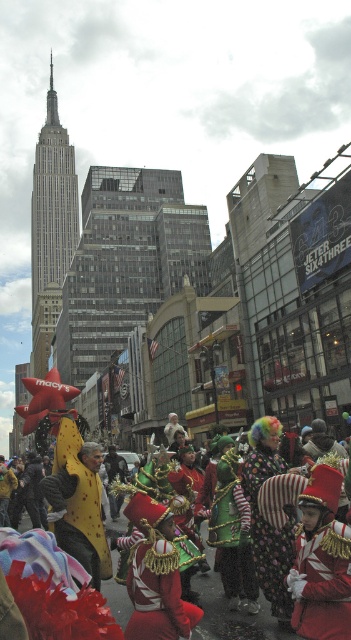
Question: From the image, what is the correct spatial relationship of shiny red uniform at center in relation to striped fabric clown hat at center?

Choices:
 (A) left
 (B) right

Answer: (B)

Question: Is striped fabric clown hat at center further to the viewer compared to shiny metallic costume at center?

Choices:
 (A) yes
 (B) no

Answer: (A)

Question: Which object is farther from the camera taking this photo?

Choices:
 (A) yellow plush at center
 (B) shiny metallic costume at center
 (C) shiny red uniform at center
 (D) striped fabric clown hat at center

Answer: (A)

Question: Is shiny red uniform at center closer to camera compared to striped fabric clown hat at center?

Choices:
 (A) yes
 (B) no

Answer: (A)

Question: Considering the real-world distances, which object is farthest from the shiny red uniform at center?

Choices:
 (A) yellow plush at center
 (B) striped fabric clown hat at center

Answer: (A)

Question: Which point is closer to the camera taking this photo?

Choices:
 (A) (328, 624)
 (B) (71, 534)
 (C) (266, 532)
 (D) (213, 576)

Answer: (A)